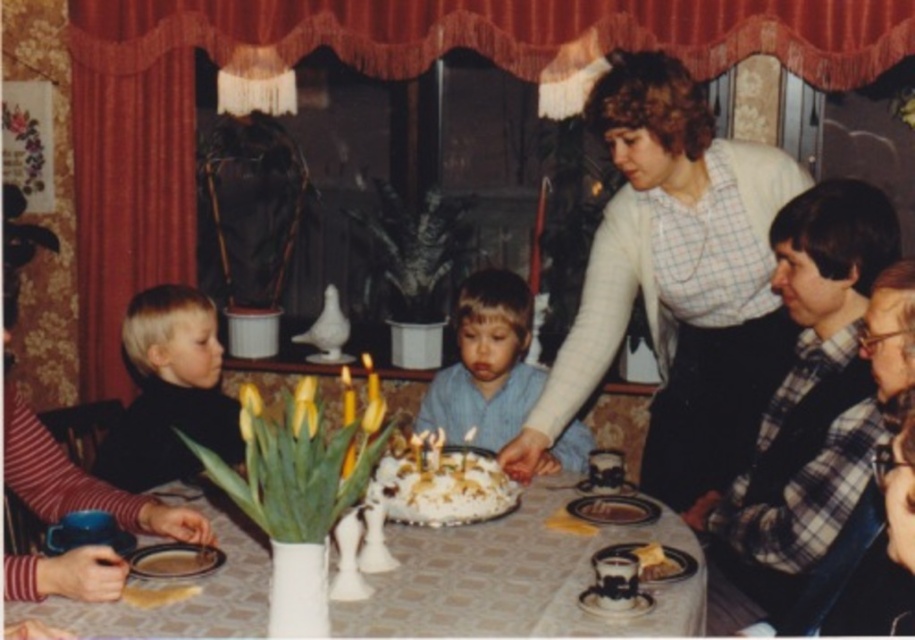
Question: Is white checkered shirt at upper center bigger than smooth black shirt at left?

Choices:
 (A) no
 (B) yes

Answer: (B)

Question: Can you confirm if smooth black shirt at left is positioned to the left of white frosted cake at center?

Choices:
 (A) yes
 (B) no

Answer: (A)

Question: Among these points, which one is farthest from the camera?

Choices:
 (A) (596, 499)
 (B) (694, 625)
 (C) (160, 440)
 (D) (447, 518)

Answer: (C)

Question: Which of the following is the farthest from the observer?

Choices:
 (A) (425, 493)
 (B) (468, 337)
 (C) (681, 586)

Answer: (B)

Question: Among these objects, which one is farthest from the camera?

Choices:
 (A) white frosted cake at center
 (B) white checkered shirt at upper center
 (C) light blue shirt at center
 (D) smooth chocolate cake at center

Answer: (C)

Question: Does light blue shirt at center appear over smooth chocolate cake at center?

Choices:
 (A) yes
 (B) no

Answer: (A)